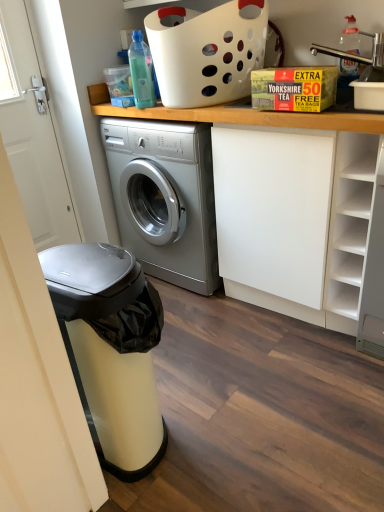
Question: Does metallic stainless steel dishwasher at left have a smaller size compared to white plastic basket at upper center?

Choices:
 (A) no
 (B) yes

Answer: (A)

Question: Is metallic stainless steel dishwasher at left facing away from white plastic basket at upper center?

Choices:
 (A) yes
 (B) no

Answer: (B)

Question: Is metallic stainless steel dishwasher at left next to white plastic basket at upper center and touching it?

Choices:
 (A) yes
 (B) no

Answer: (B)

Question: Would you say white plastic basket at upper center is part of metallic stainless steel dishwasher at left's contents?

Choices:
 (A) yes
 (B) no

Answer: (B)

Question: Considering the relative sizes of metallic stainless steel dishwasher at left and white plastic basket at upper center in the image provided, is metallic stainless steel dishwasher at left bigger than white plastic basket at upper center?

Choices:
 (A) yes
 (B) no

Answer: (A)

Question: Considering their positions, is transparent plastic bottle at upper left, arranged as the 2th bottle when viewed from the right, located in front of or behind clear plastic bottle at upper right, acting as the first bottle starting from the right?

Choices:
 (A) behind
 (B) front

Answer: (B)

Question: From the image's perspective, is transparent plastic bottle at upper left, the 1th bottle from the left, located above or below clear plastic bottle at upper right, the 2th bottle from the left?

Choices:
 (A) below
 (B) above

Answer: (A)

Question: Is point (137, 58) positioned closer to the camera than point (347, 28)?

Choices:
 (A) farther
 (B) closer

Answer: (B)

Question: Is transparent plastic bottle at upper left, the 1th bottle from the left, situated inside clear plastic bottle at upper right, acting as the first bottle starting from the right, or outside?

Choices:
 (A) outside
 (B) inside

Answer: (A)

Question: Is metallic stainless steel dishwasher at left in front of or behind white plastic basket at upper center in the image?

Choices:
 (A) behind
 (B) front

Answer: (B)

Question: From a real-world perspective, is metallic stainless steel dishwasher at left physically located above or below white plastic basket at upper center?

Choices:
 (A) above
 (B) below

Answer: (B)

Question: Looking at the image, does metallic stainless steel dishwasher at left seem bigger or smaller compared to white plastic basket at upper center?

Choices:
 (A) big
 (B) small

Answer: (A)

Question: Is metallic stainless steel dishwasher at left inside the boundaries of white plastic basket at upper center, or outside?

Choices:
 (A) inside
 (B) outside

Answer: (B)

Question: Do you think transparent plastic bottle at upper left, arranged as the 2th bottle when viewed from the right, is within yellow cardboard box at upper center, or outside of it?

Choices:
 (A) outside
 (B) inside

Answer: (A)

Question: In terms of height, does transparent plastic bottle at upper left, arranged as the 2th bottle when viewed from the right, look taller or shorter compared to yellow cardboard box at upper center?

Choices:
 (A) short
 (B) tall

Answer: (A)